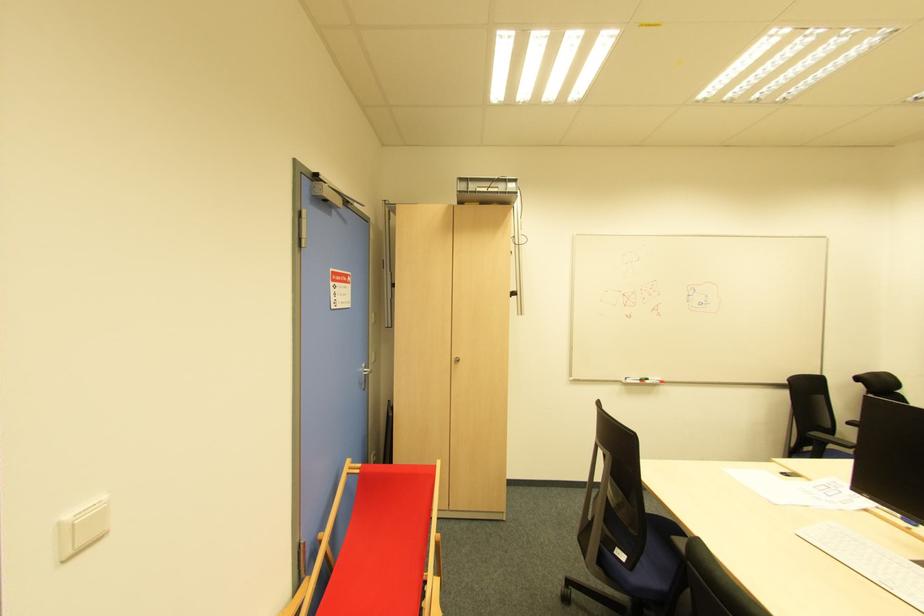
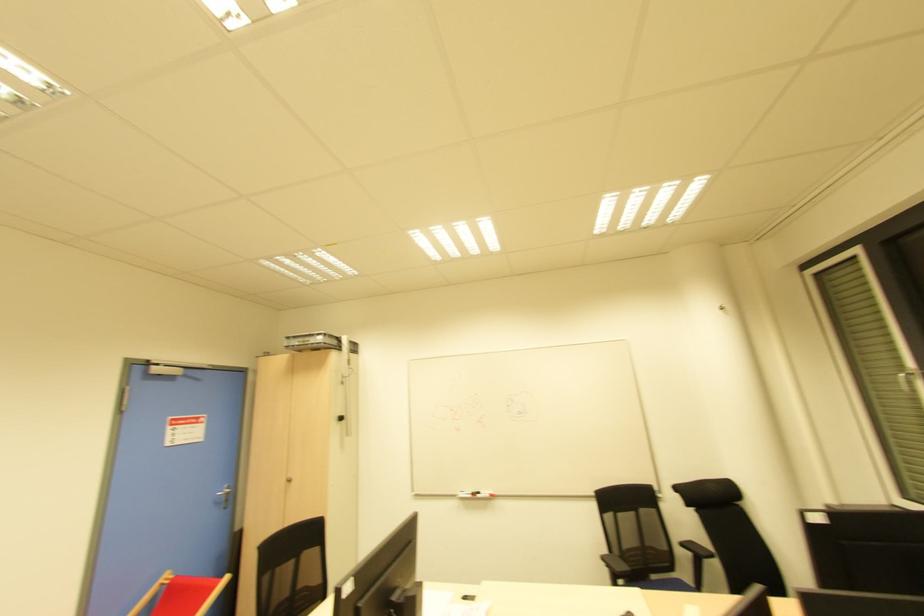
The point at (849, 424) is marked in the first image. Where is the corresponding point in the second image?

(681, 545)